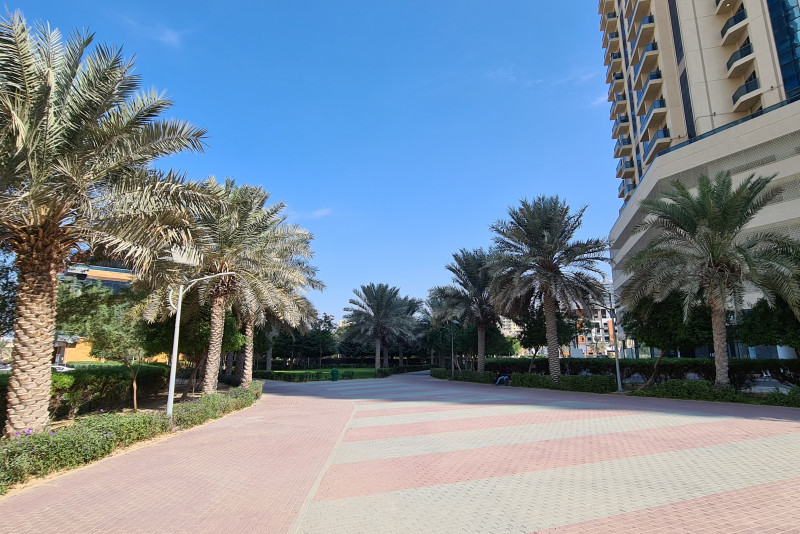
You are a GUI agent. You are given a task and a screenshot of the screen. Output one action in this format:
    pyautogui.click(x=<x>, y=<y>)
    Task: Click on the shade
    
    Given the screenshot: What is the action you would take?
    pyautogui.click(x=366, y=396)